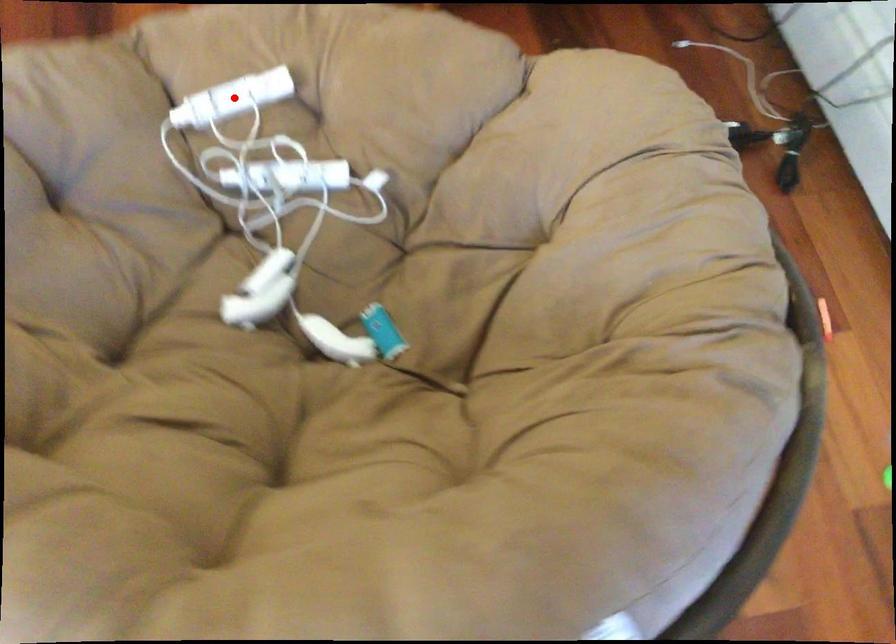
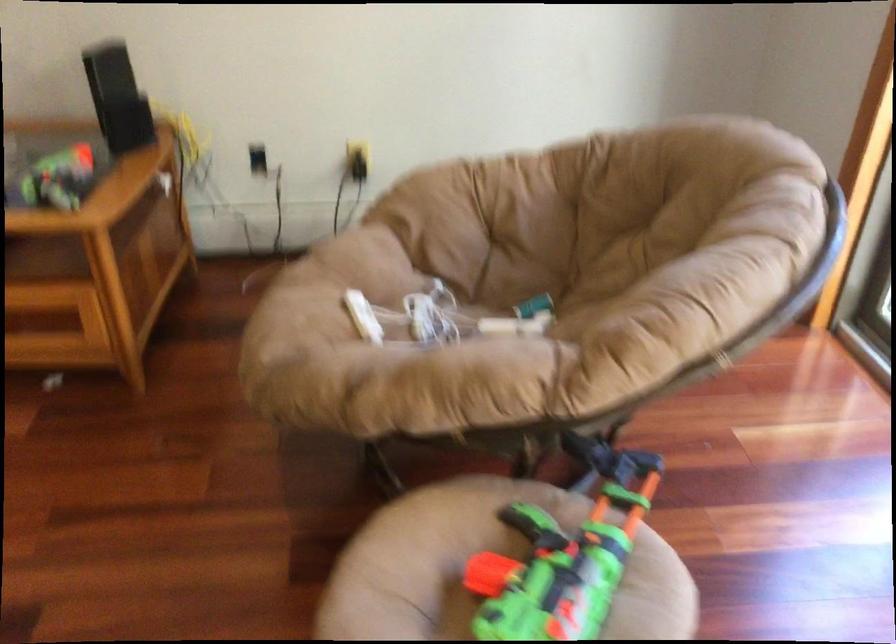
In the second image, find the point that corresponds to the highlighted location in the first image.

(363, 317)